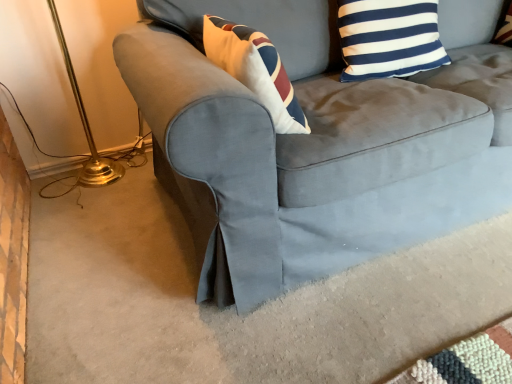
Question: From the image's perspective, relative to suede gray couch at lower right, is blue and white striped pillow at upper right above or below?

Choices:
 (A) above
 (B) below

Answer: (A)

Question: From a real-world perspective, is blue and white striped pillow at upper right positioned above or below suede gray couch at lower right?

Choices:
 (A) below
 (B) above

Answer: (B)

Question: Does point (423, 43) appear closer or farther from the camera than point (321, 243)?

Choices:
 (A) closer
 (B) farther

Answer: (B)

Question: From a real-world perspective, is suede gray couch at lower right positioned above or below blue and white striped pillow at upper right?

Choices:
 (A) below
 (B) above

Answer: (A)

Question: Looking at the image, does suede gray couch at lower right seem bigger or smaller compared to blue and white striped pillow at upper right?

Choices:
 (A) small
 (B) big

Answer: (B)

Question: Considering their positions, is suede gray couch at lower right located in front of or behind blue and white striped pillow at upper right?

Choices:
 (A) behind
 (B) front

Answer: (B)

Question: Looking at their shapes, would you say suede gray couch at lower right is wider or thinner than blue and white striped pillow at upper right?

Choices:
 (A) wide
 (B) thin

Answer: (A)